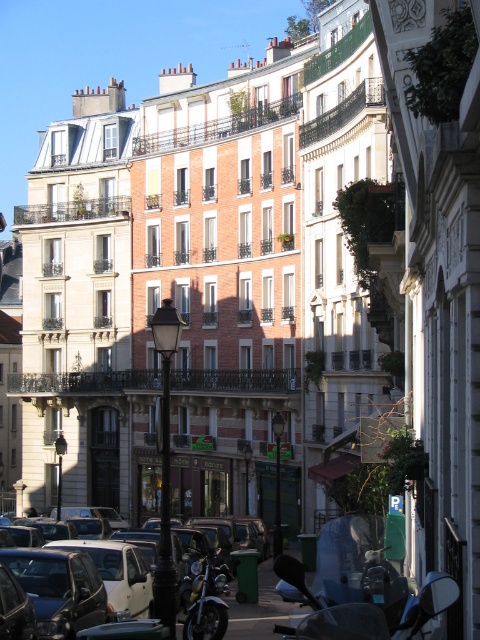
Question: Estimate the real-world distances between objects in this image. Which object is closer to the shiny chrome motorcycle at center?

Choices:
 (A) white matte car at center
 (B) shiny chrome motorcycle at lower right

Answer: (A)

Question: Which object is the farthest from the white matte car at center?

Choices:
 (A) shiny chrome motorcycle at center
 (B) shiny chrome motorcycle at lower right

Answer: (B)

Question: Is shiny chrome motorcycle at center positioned in front of white matte car at center?

Choices:
 (A) yes
 (B) no

Answer: (A)

Question: Can you confirm if shiny chrome motorcycle at center is smaller than white matte car at center?

Choices:
 (A) yes
 (B) no

Answer: (A)

Question: From the image, what is the correct spatial relationship of shiny chrome motorcycle at lower right in relation to shiny chrome motorcycle at center?

Choices:
 (A) below
 (B) above

Answer: (B)

Question: Which object appears farthest from the camera in this image?

Choices:
 (A) white matte car at center
 (B) shiny chrome motorcycle at center

Answer: (A)